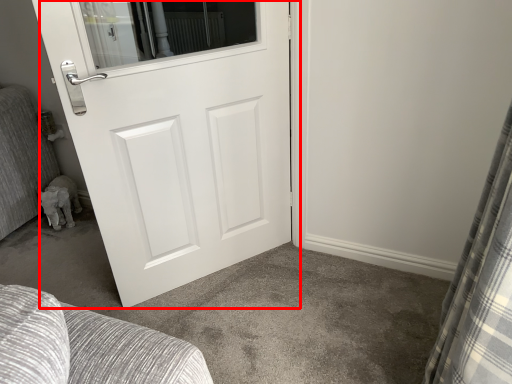
Question: In this image, where is door (annotated by the red box) located relative to curtain?

Choices:
 (A) left
 (B) right

Answer: (A)